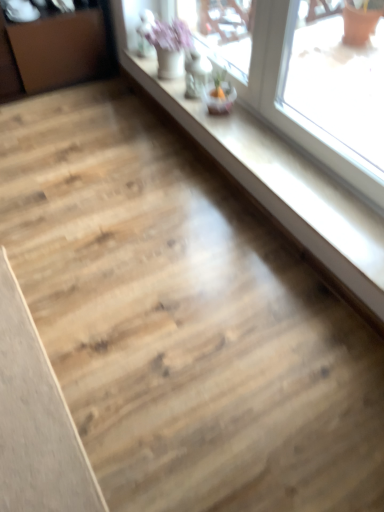
Question: From the image's perspective, is light brown wood plank at lower left below transparent glass window at upper right?

Choices:
 (A) no
 (B) yes

Answer: (B)

Question: Does light brown wood plank at lower left have a larger size compared to transparent glass window at upper right?

Choices:
 (A) no
 (B) yes

Answer: (A)

Question: Considering the relative sizes of light brown wood plank at lower left and transparent glass window at upper right in the image provided, is light brown wood plank at lower left smaller than transparent glass window at upper right?

Choices:
 (A) no
 (B) yes

Answer: (B)

Question: Is light brown wood plank at lower left to the right of transparent glass window at upper right from the viewer's perspective?

Choices:
 (A) no
 (B) yes

Answer: (A)

Question: Is light brown wood plank at lower left aimed at transparent glass window at upper right?

Choices:
 (A) yes
 (B) no

Answer: (B)

Question: From the image's perspective, is light brown wood plank at lower left located above or below brown wood dresser at left?

Choices:
 (A) above
 (B) below

Answer: (B)

Question: Based on their sizes in the image, would you say light brown wood plank at lower left is bigger or smaller than brown wood dresser at left?

Choices:
 (A) small
 (B) big

Answer: (A)

Question: Relative to brown wood dresser at left, is light brown wood plank at lower left in front or behind?

Choices:
 (A) front
 (B) behind

Answer: (A)

Question: Is light brown wood plank at lower left to the left or to the right of brown wood dresser at left in the image?

Choices:
 (A) left
 (B) right

Answer: (B)

Question: In terms of width, does transparent glass window at upper right look wider or thinner when compared to light brown wood plank at lower left?

Choices:
 (A) thin
 (B) wide

Answer: (A)

Question: In terms of height, does transparent glass window at upper right look taller or shorter compared to light brown wood plank at lower left?

Choices:
 (A) short
 (B) tall

Answer: (B)

Question: From the image's perspective, is transparent glass window at upper right located above or below light brown wood plank at lower left?

Choices:
 (A) above
 (B) below

Answer: (A)

Question: Is point (372, 219) closer or farther from the camera than point (23, 464)?

Choices:
 (A) closer
 (B) farther

Answer: (B)

Question: Does point (193, 123) appear closer or farther from the camera than point (92, 32)?

Choices:
 (A) farther
 (B) closer

Answer: (B)

Question: From the image's perspective, relative to brown wood dresser at left, is transparent glass window at upper right above or below?

Choices:
 (A) below
 (B) above

Answer: (A)